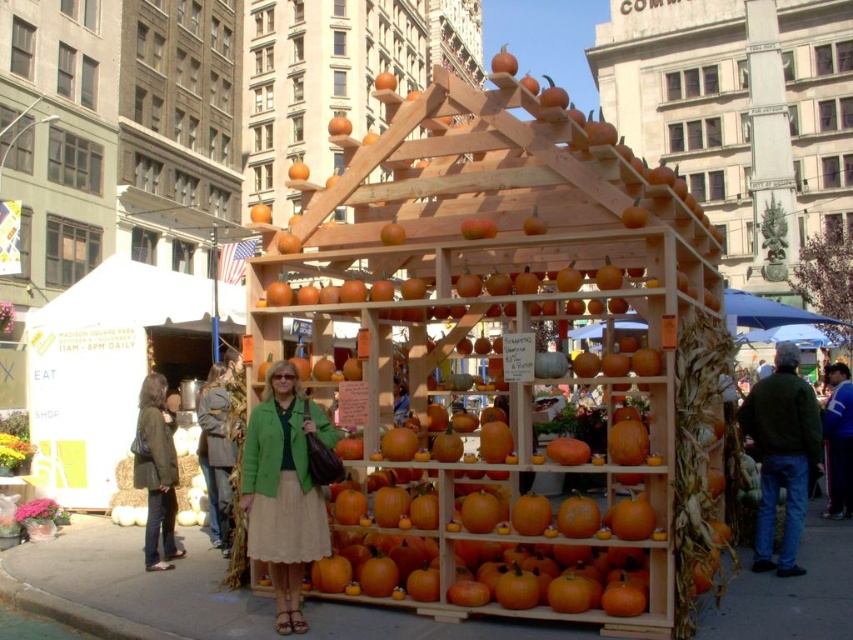
Does dark green jacket at right appear on the right side of matte green jacket at lower left?

Yes, dark green jacket at right is to the right of matte green jacket at lower left.

Is point (802, 506) positioned in front of point (164, 410)?

Yes, it is.

Identify the location of dark green jacket at right. (782, 454).

Who is higher up, green fabric jacket at center or dark green jacket at right?

Positioned higher is dark green jacket at right.

In the scene shown: Who is lower down, green fabric jacket at center or dark green jacket at right?

green fabric jacket at center

This screenshot has height=640, width=853. Describe the element at coordinates (283, 490) in the screenshot. I see `green fabric jacket at center` at that location.

You are a GUI agent. You are given a task and a screenshot of the screen. Output one action in this format:
    pyautogui.click(x=<x>, y=<y>)
    Task: Click on the green fabric jacket at center
    This screenshot has height=640, width=853.
    Given the screenshot: What is the action you would take?
    pos(283,490)

Can you confirm if green fabric jacket at center is wider than blue fleece jacket at lower right?

Incorrect, green fabric jacket at center's width does not surpass blue fleece jacket at lower right's.

Is green fabric jacket at center further to the viewer compared to blue fleece jacket at lower right?

No, green fabric jacket at center is closer to the viewer.

Which is behind, point (271, 380) or point (844, 417)?

The point (844, 417) is more distant.

This screenshot has width=853, height=640. Identify the location of green fabric jacket at center. (283, 490).